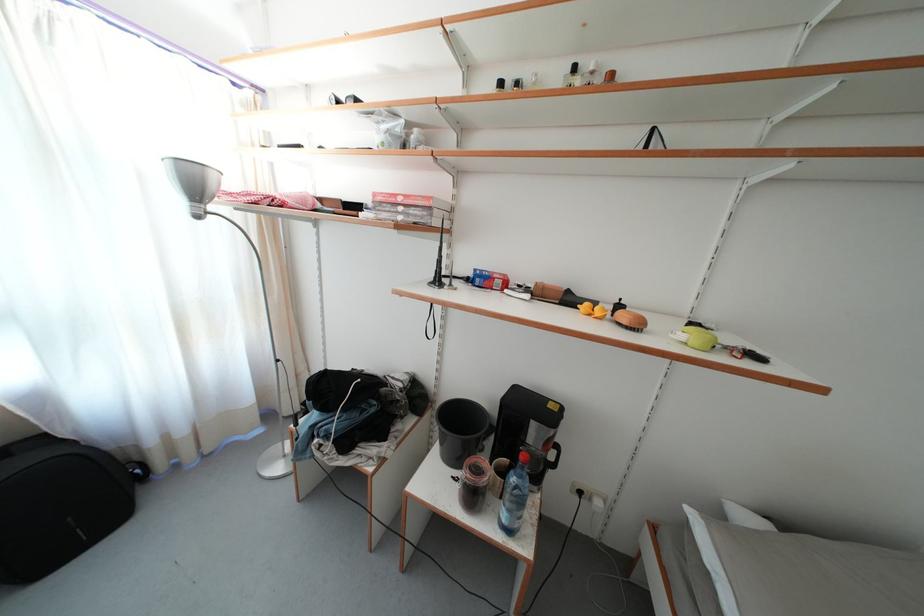
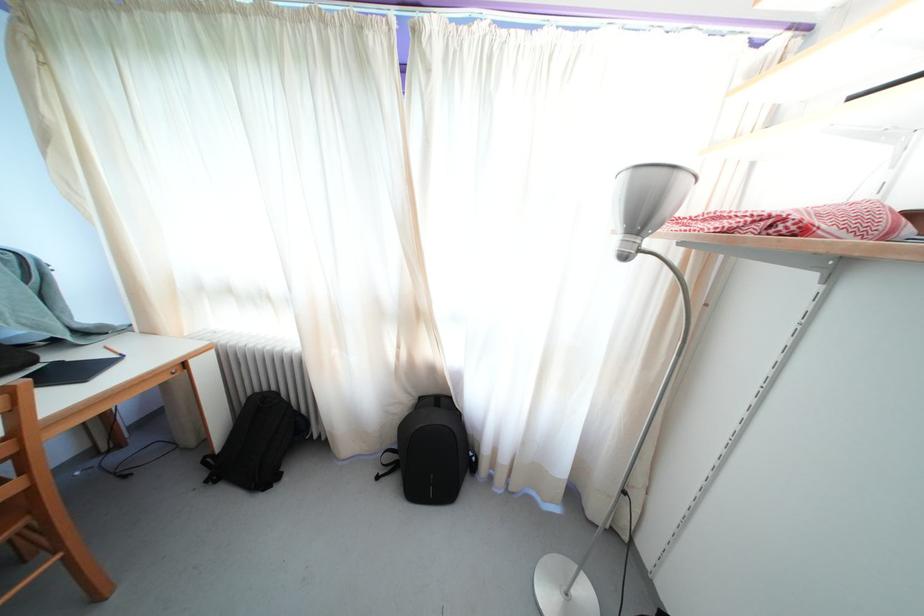
Question: The camera is either moving clockwise (left) or counter-clockwise (right) around the object. The first image is from the beginning of the video and the second image is from the end. Is the camera moving left or right when shooting the video?

Choices:
 (A) Left
 (B) Right

Answer: (B)